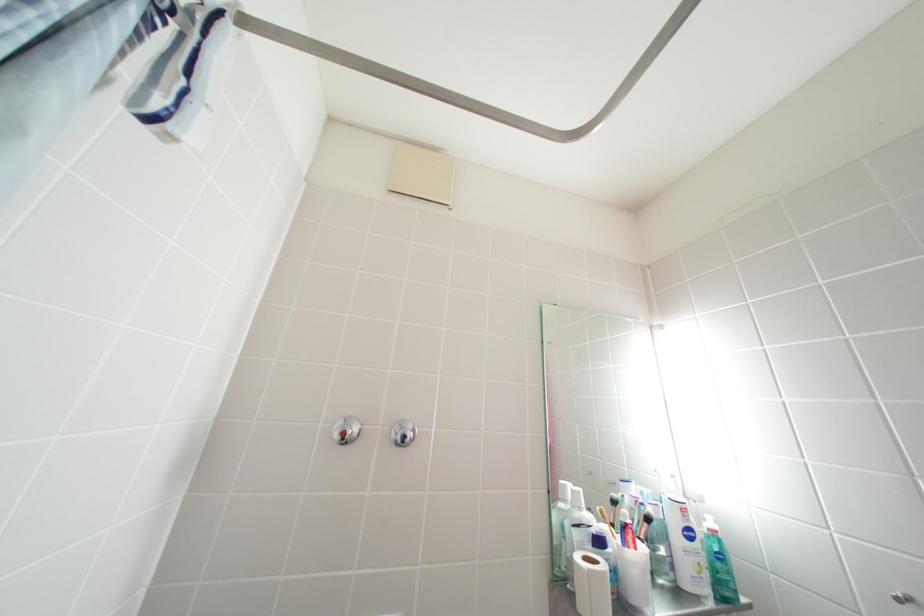
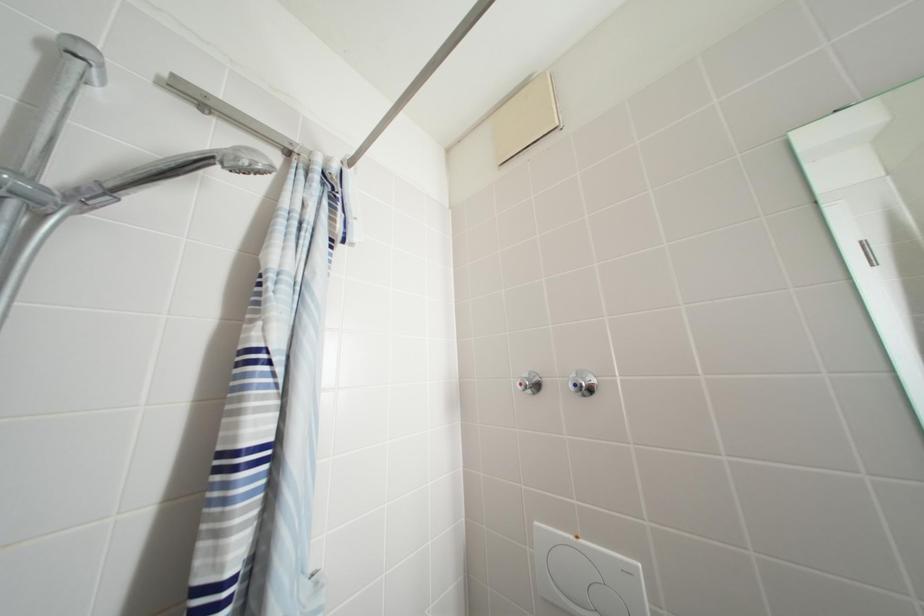
Question: The images are taken continuously from a first-person perspective. In which direction is your viewpoint rotating?

Choices:
 (A) Left
 (B) Right
 (C) Up
 (D) Down

Answer: (A)